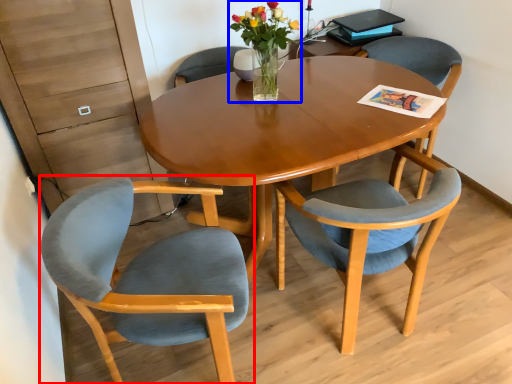
Question: Among these objects, which one is nearest to the camera, chair (highlighted by a red box) or floral arrangement (highlighted by a blue box)?

Choices:
 (A) chair
 (B) floral arrangement

Answer: (A)